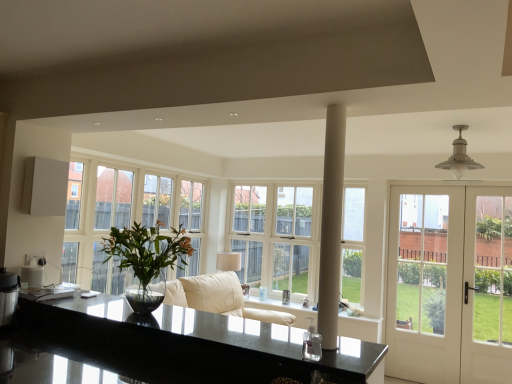
Describe the element at coordinates (450, 284) in the screenshot. I see `white glossy door at right` at that location.

The height and width of the screenshot is (384, 512). I want to click on white glossy door at right, so click(450, 284).

Image resolution: width=512 pixels, height=384 pixels. What do you see at coordinates (278, 238) in the screenshot?
I see `white glass window at center` at bounding box center [278, 238].

Find the location of a particular element. white smooth column at center is located at coordinates (331, 226).

What do you see at coordinates (191, 344) in the screenshot?
I see `black granite countertop at center` at bounding box center [191, 344].

You are a GUI agent. You are given a task and a screenshot of the screen. Output one action in this format:
    pyautogui.click(x=<x>, y=<y>)
    Task: Click on the white glossy door at right
    The height and width of the screenshot is (384, 512).
    Given the screenshot: What is the action you would take?
    pyautogui.click(x=450, y=284)

Does white glass window at center turn towards black granite countertop at center?

Yes, white glass window at center is facing black granite countertop at center.

Is the position of white glass window at center less distant than that of black granite countertop at center?

No, white glass window at center is behind black granite countertop at center.

Is white glass window at center to the left of black granite countertop at center from the viewer's perspective?

No.

In the scene shown: Considering the positions of objects white glossy door at right and green glossy vase at left in the image provided, who is in front, white glossy door at right or green glossy vase at left?

green glossy vase at left is more forward.

How many degrees apart are the facing directions of white glossy door at right and green glossy vase at left?

The angular difference between white glossy door at right and green glossy vase at left is 2.66 degrees.

Looking at this image, choose the correct answer: Is white glossy door at right inside green glossy vase at left or outside it?

white glossy door at right lies outside green glossy vase at left.

Is white glossy door at right wider or thinner than green glossy vase at left?

Considering their sizes, white glossy door at right looks slimmer than green glossy vase at left.

Based on the photo, is black granite countertop at center looking in the opposite direction of white glass window at center?

Yes, black granite countertop at center's orientation is away from white glass window at center.

Is point (200, 329) closer or farther from the camera than point (267, 238)?

Clearly, point (200, 329) is closer to the camera than point (267, 238).

From the picture: From the image's perspective, is black granite countertop at center above white glass window at center?

No.

Consider the image. How different are the orientations of black granite countertop at center and white glass window at center in degrees?

The facing directions of black granite countertop at center and white glass window at center are 0.846 degrees apart.

Considering the sizes of objects black granite countertop at center and white smooth column at center in the image provided, who is taller, black granite countertop at center or white smooth column at center?

With more height is white smooth column at center.

Which point is more distant from viewer, (244,325) or (327,179)?

Positioned behind is point (244,325).

From a real-world perspective, is black granite countertop at center above or below white smooth column at center?

black granite countertop at center is below white smooth column at center.

Which of these two, black granite countertop at center or white smooth column at center, is smaller?

white smooth column at center is smaller.

Is point (149, 298) positioned in front of point (343, 166)?

No.

From the image's perspective, relative to white smooth column at center, is green glossy vase at left above or below?

green glossy vase at left is situated lower than white smooth column at center in the image.

Is green glossy vase at left in front of white smooth column at center?

No, it is behind white smooth column at center.

Is the position of green glossy vase at left more distant than that of white glossy door at right?

No, the depth of green glossy vase at left is less than that of white glossy door at right.

Can you tell me how much green glossy vase at left and white glossy door at right differ in facing direction?

2.66 degrees.

Who is smaller, green glossy vase at left or white glossy door at right?

With smaller size is green glossy vase at left.

Is black granite countertop at center at the back of green glossy vase at left?

No, green glossy vase at left is not facing the opposite direction of black granite countertop at center.

Which object is wider, green glossy vase at left or black granite countertop at center?

With larger width is black granite countertop at center.

From a real-world perspective, between green glossy vase at left and black granite countertop at center, who is vertically higher?

In real-world perspective, green glossy vase at left is above.

What's the angular difference between green glossy vase at left and black granite countertop at center's facing directions?

The angular difference between green glossy vase at left and black granite countertop at center is 2.36 degrees.

You are a GUI agent. You are given a task and a screenshot of the screen. Output one action in this format:
    pyautogui.click(x=<x>, y=<y>)
    Task: Click on the window above the black granite countertop at center (from a real-world perspective)
    
    Given the screenshot: What is the action you would take?
    pyautogui.click(x=278, y=238)

The width and height of the screenshot is (512, 384). In order to click on door that appears below the green glossy vase at left (from a real-world perspective) in this screenshot , I will do `click(450, 284)`.

Estimate the real-world distances between objects in this image. Which object is closer to white glossy door at right, green glossy vase at left or white glass window at center?

white glass window at center is positioned closer to the anchor white glossy door at right.

Estimate the real-world distances between objects in this image. Which object is closer to white glossy door at right, white smooth column at center or black granite countertop at center?

black granite countertop at center lies closer to white glossy door at right than the other object.

Looking at this image, which object lies further to the anchor point green glossy vase at left, white glass window at center or black granite countertop at center?

Among the two, white glass window at center is located further to green glossy vase at left.

Estimate the real-world distances between objects in this image. Which object is further from white smooth column at center, white glass window at center or green glossy vase at left?

Among the two, white glass window at center is located further to white smooth column at center.

Based on the photo, which object lies nearer to the anchor point white glossy door at right, green glossy vase at left or white smooth column at center?

The object closer to white glossy door at right is green glossy vase at left.

From the image, which object appears to be nearer to white glass window at center, white smooth column at center or green glossy vase at left?

green glossy vase at left lies closer to white glass window at center than the other object.

Estimate the real-world distances between objects in this image. Which object is closer to green glossy vase at left, white glossy door at right or white smooth column at center?

white smooth column at center.

From the picture: Estimate the real-world distances between objects in this image. Which object is further from white glass window at center, black granite countertop at center or white glossy door at right?

Among the two, black granite countertop at center is located further to white glass window at center.

Where is `pillar between black granite countertop at center and white glass window at center along the z-axis`? pillar between black granite countertop at center and white glass window at center along the z-axis is located at coordinates (331, 226).

In order to click on countertop between green glossy vase at left and white glossy door at right in this screenshot , I will do click(191, 344).

You are a GUI agent. You are given a task and a screenshot of the screen. Output one action in this format:
    pyautogui.click(x=<x>, y=<y>)
    Task: Click on the pillar between green glossy vase at left and white glossy door at right from left to right
    The width and height of the screenshot is (512, 384).
    Given the screenshot: What is the action you would take?
    pyautogui.click(x=331, y=226)

At what (x,y) coordinates should I click in order to perform the action: click on countertop between green glossy vase at left and white smooth column at center from left to right. Please return your answer as a coordinate pair (x, y). Looking at the image, I should click on click(191, 344).